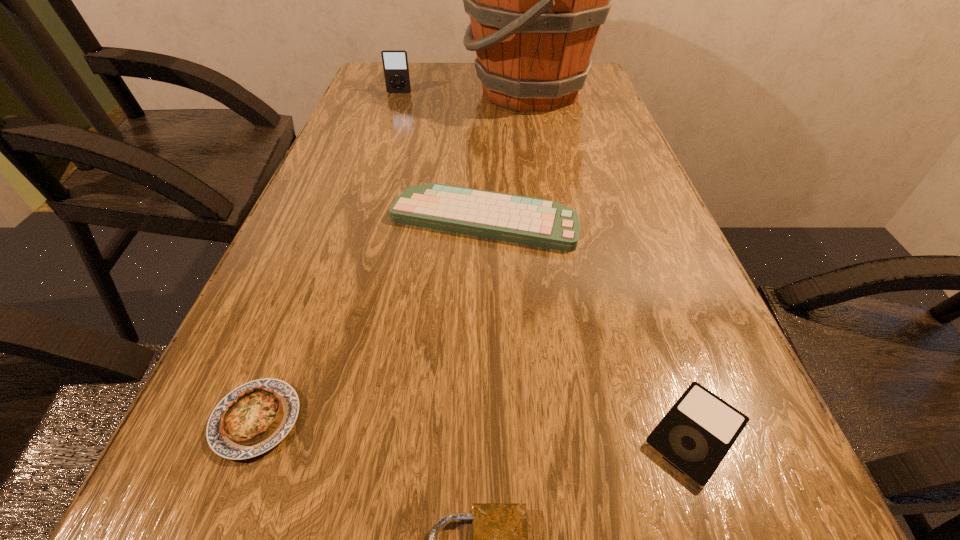
Where is `free space located 0.280m on the handle side of the tallest object`? The height and width of the screenshot is (540, 960). free space located 0.280m on the handle side of the tallest object is located at coordinates (371, 92).

In order to click on free location located 0.310m on the front-facing side of the farther iPod in this screenshot , I will do `click(383, 144)`.

Identify the location of free region located 0.140m on the left of the fourth shortest object. (321, 220).

Image resolution: width=960 pixels, height=540 pixels. I want to click on free space located 0.090m on the back of the quiche, so pyautogui.click(x=290, y=332).

Where is `free spot located 0.330m on the back of the right iPod`? This screenshot has width=960, height=540. free spot located 0.330m on the back of the right iPod is located at coordinates (624, 236).

The width and height of the screenshot is (960, 540). What are the coordinates of `object that is at the far edge` in the screenshot? It's located at (536, 0).

Locate an element on the screen. The image size is (960, 540). iPod that is positioned at the left edge is located at coordinates coord(395,61).

Where is `quiche present at the left edge`? quiche present at the left edge is located at coordinates (253, 418).

The height and width of the screenshot is (540, 960). Identify the location of bucket that is at the right edge. (536, 0).

Where is `iPod at the right edge`? The height and width of the screenshot is (540, 960). iPod at the right edge is located at coordinates (695, 435).